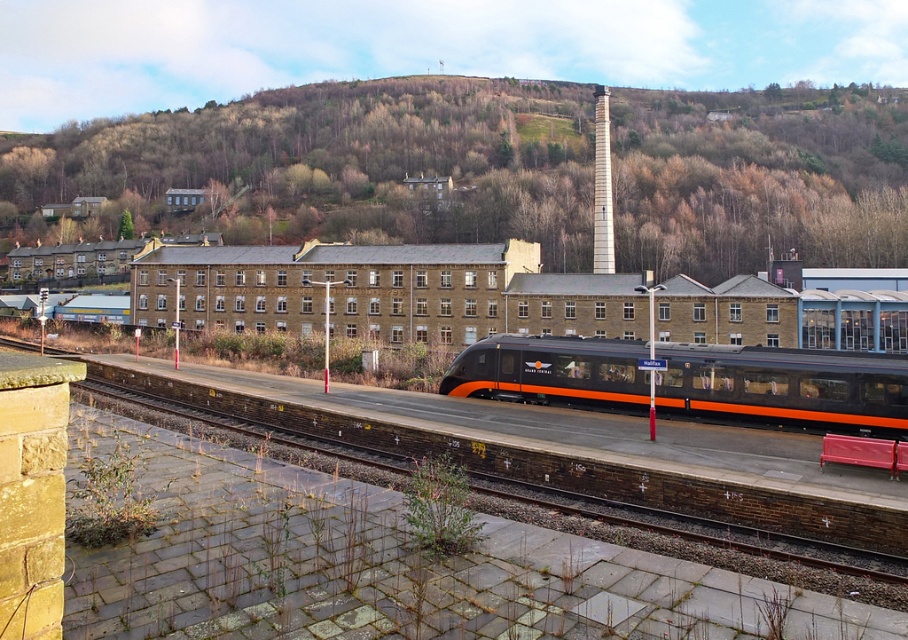
Can you confirm if brown textured hillside at upper center is positioned above matte black train at center?

Indeed, brown textured hillside at upper center is positioned over matte black train at center.

Who is positioned more to the left, brown textured hillside at upper center or matte black train at center?

From the viewer's perspective, brown textured hillside at upper center appears more on the left side.

Does point (376, 179) come closer to viewer compared to point (704, 403)?

No, it is behind (704, 403).

Find the location of a particular element. The height and width of the screenshot is (640, 908). brown textured hillside at upper center is located at coordinates click(x=329, y=166).